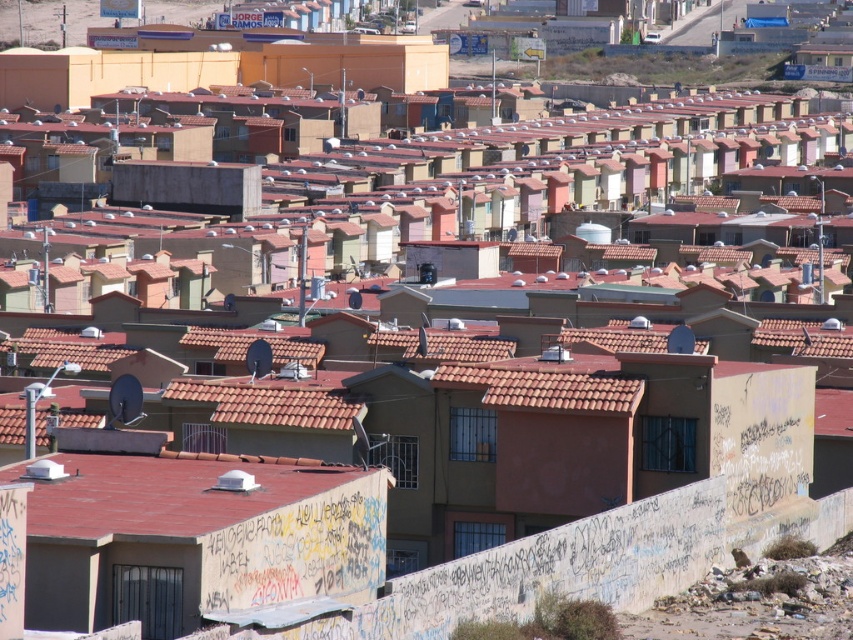
Is red tile roof at lower left taller than brown tile roof at center?

Yes, red tile roof at lower left is taller than brown tile roof at center.

Does point (289, 472) lie in front of point (564, 404)?

Yes, it is in front of point (564, 404).

I want to click on red tile roof at lower left, so click(167, 493).